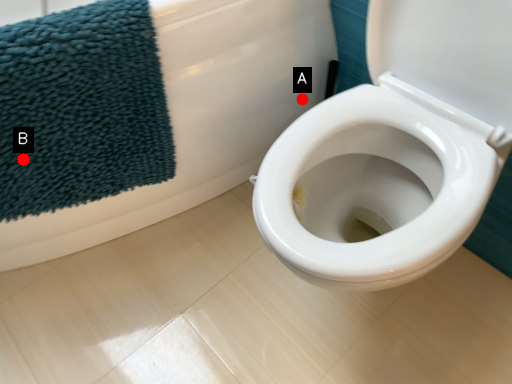
Question: Two points are circled on the image, labeled by A and B beside each circle. Which point is farther to the camera?

Choices:
 (A) A is further
 (B) B is further

Answer: (A)